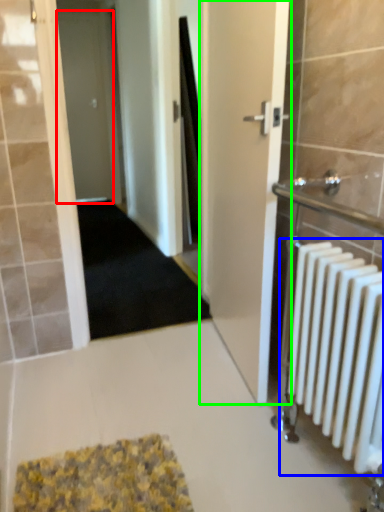
Question: Which object is the farthest from door (highlighted by a red box)? Choose among these: radiator (highlighted by a blue box) or door (highlighted by a green box).

Choices:
 (A) radiator
 (B) door

Answer: (A)